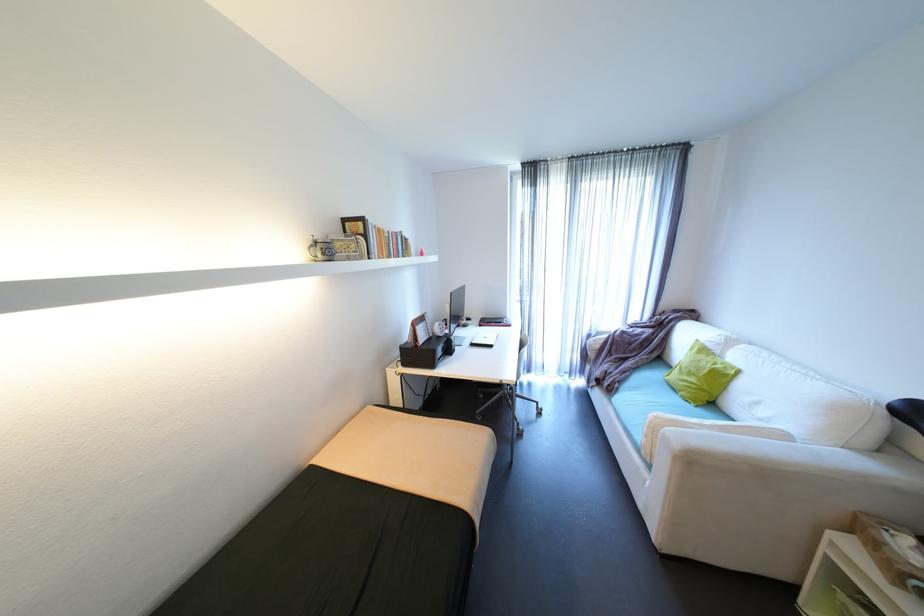
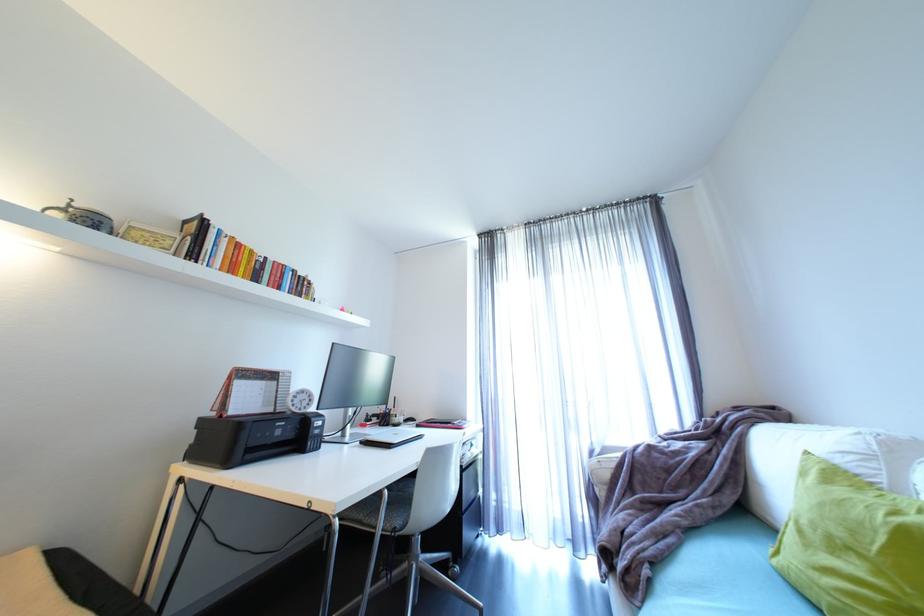
Find the pixel in the second image that matches pixel 624 386 in the first image.

(653, 572)